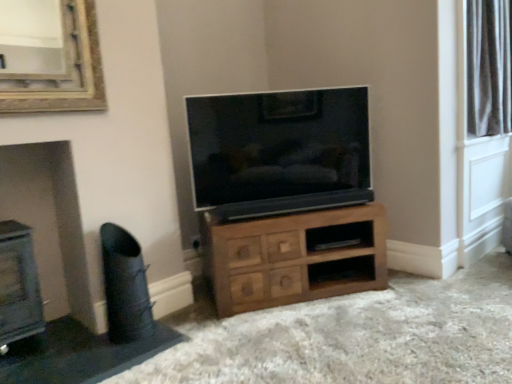
Question: From the image's perspective, is silky white curtains at upper right located above black leather swivel chair at lower left?

Choices:
 (A) no
 (B) yes

Answer: (B)

Question: From a real-world perspective, is silky white curtains at upper right physically above black leather swivel chair at lower left?

Choices:
 (A) no
 (B) yes

Answer: (B)

Question: Does silky white curtains at upper right have a larger size compared to black leather swivel chair at lower left?

Choices:
 (A) no
 (B) yes

Answer: (B)

Question: From the image's perspective, is silky white curtains at upper right below black leather swivel chair at lower left?

Choices:
 (A) no
 (B) yes

Answer: (A)

Question: Considering the relative positions of silky white curtains at upper right and black leather swivel chair at lower left in the image provided, is silky white curtains at upper right in front of black leather swivel chair at lower left?

Choices:
 (A) yes
 (B) no

Answer: (B)

Question: Can you confirm if silky white curtains at upper right is thinner than black leather swivel chair at lower left?

Choices:
 (A) no
 (B) yes

Answer: (B)

Question: Does silky white curtains at upper right appear on the right side of wooden chest of drawers at center?

Choices:
 (A) yes
 (B) no

Answer: (A)

Question: Is silky white curtains at upper right positioned before wooden chest of drawers at center?

Choices:
 (A) no
 (B) yes

Answer: (A)

Question: From the image's perspective, is silky white curtains at upper right located above wooden chest of drawers at center?

Choices:
 (A) yes
 (B) no

Answer: (A)

Question: Does silky white curtains at upper right have a greater width compared to wooden chest of drawers at center?

Choices:
 (A) yes
 (B) no

Answer: (B)

Question: Does silky white curtains at upper right have a greater height compared to wooden chest of drawers at center?

Choices:
 (A) no
 (B) yes

Answer: (B)

Question: Is silky white curtains at upper right thinner than wooden chest of drawers at center?

Choices:
 (A) yes
 (B) no

Answer: (A)

Question: Does black leather swivel chair at lower left turn towards wooden shelf at center?

Choices:
 (A) no
 (B) yes

Answer: (A)